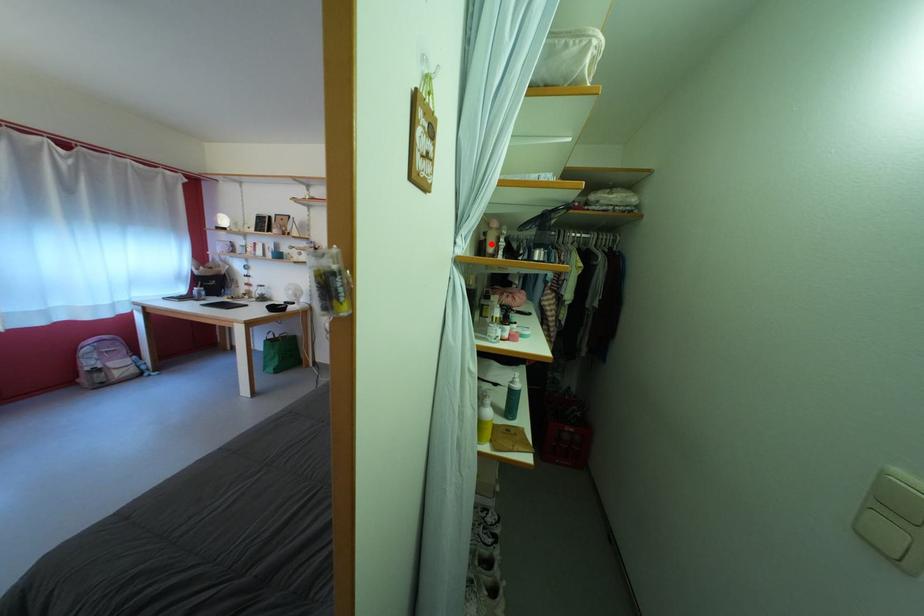
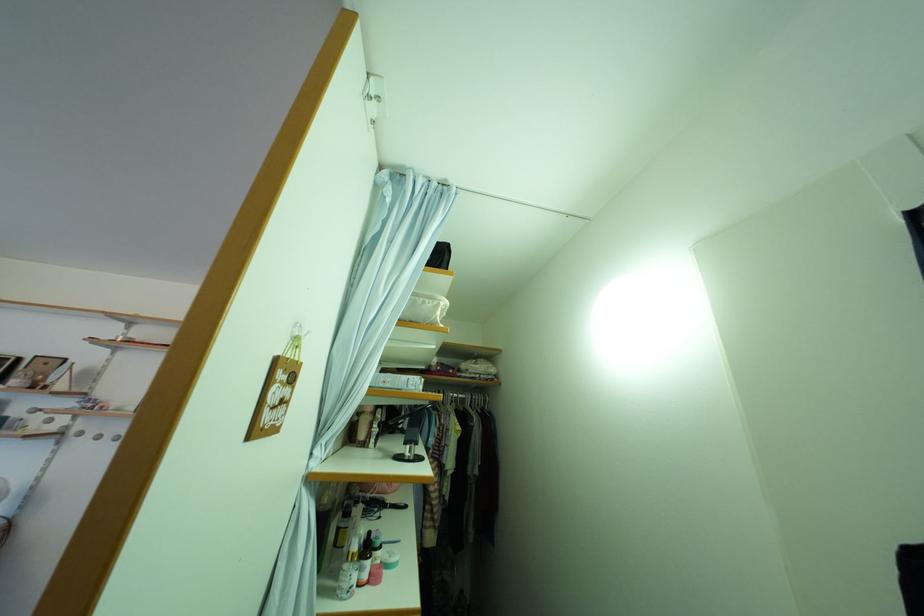
The point at the highlighted location is marked in the first image. Where is the corresponding point in the second image?

(363, 424)